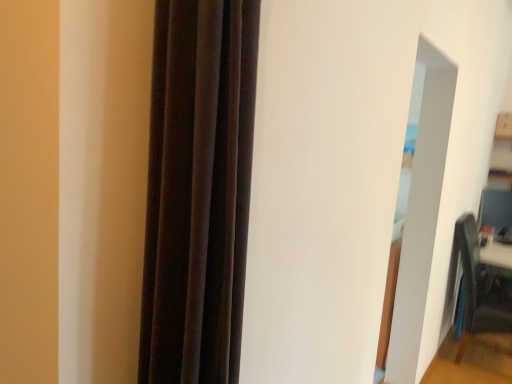
Question: Should I look upward or downward to see teal fabric armchair at lower right?

Choices:
 (A) up
 (B) down

Answer: (B)